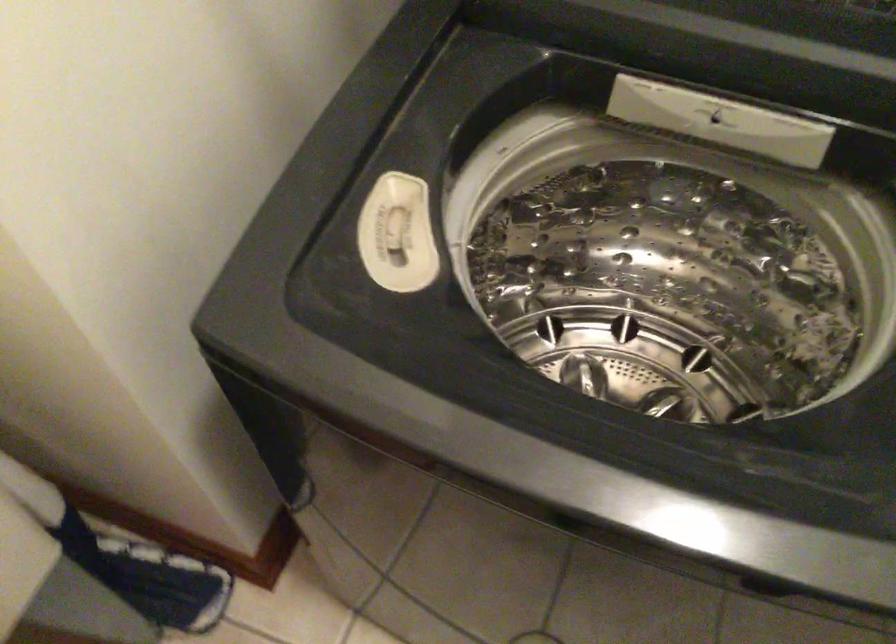
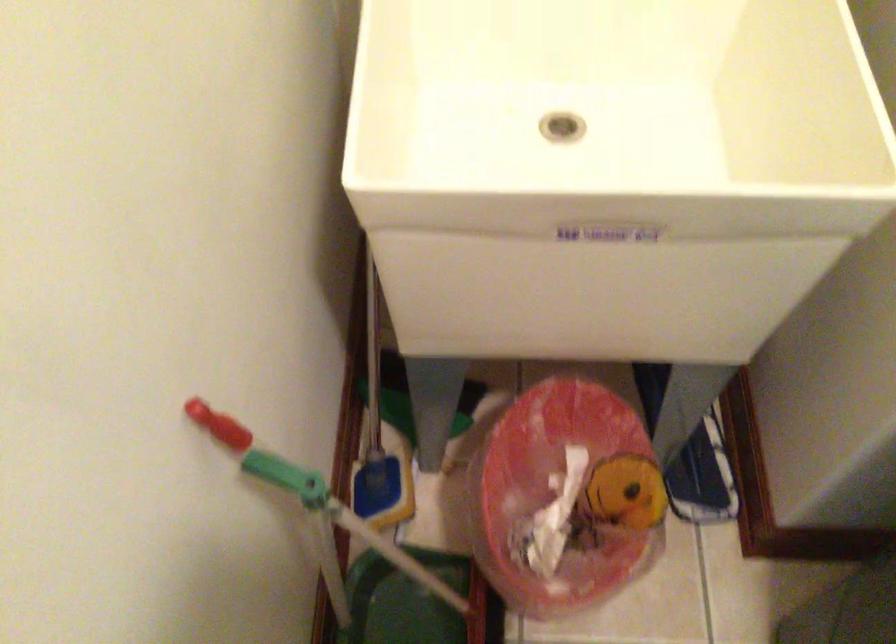
Question: I am providing you with two images of the same scene from different viewpoints. After the viewpoint changes to image2, which objects are now occluded?

Choices:
 (A) blue and white shoe
 (B) orange pumpkin object
 (C) red plastic bucket
 (D) red and green handle

Answer: (A)